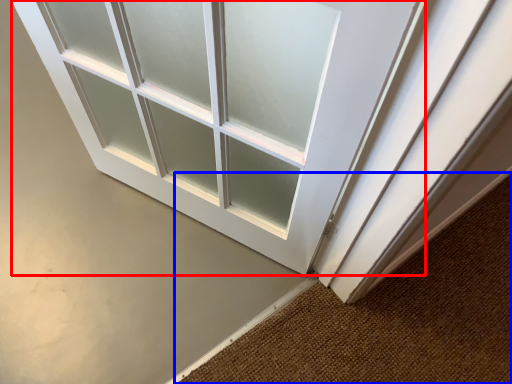
Question: Which point is closer to the camera, door (highlighted by a red box) or doormat (highlighted by a blue box)?

Choices:
 (A) door
 (B) doormat

Answer: (B)